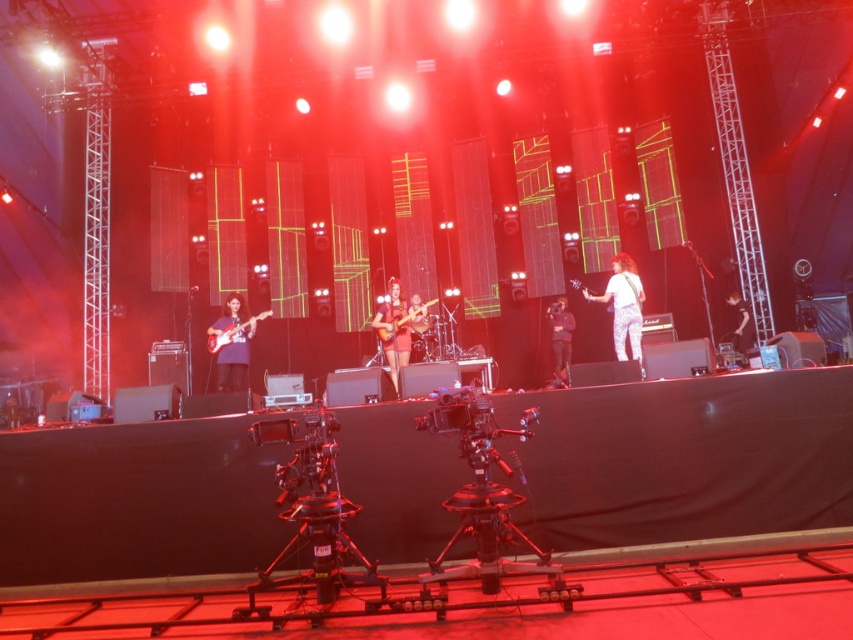
You are a photographer in the front row of the concert. You want to take a photo of both the matte purple guitar at left and the matte pink guitar at center. Which guitar will appear larger in your photo?

The matte purple guitar at left will appear larger in the photo because it is closer to the viewer than the matte pink guitar at center.

You are a photographer standing at the back of the venue, and you want to capture a closeup shot of both the matte purple guitar at left and the matte black electric guitar at left. Given that your camera has a maximum focus range of 10 centimeters, will you be able to capture both guitars in the same frame?

The matte purple guitar at left is 11.16 centimeters away from the matte black electric guitar at left. Since the distance between them exceeds the camera maximum focus range of 10 centimeters, you cannot capture both guitars in the same frame.

You are an audience member sitting in the front row of the live music performance. You notice two points on the stage marked as point 1 at coordinates point (231, 360) and point 2 at coordinates point (210, 342). Which point is closer to you?

Point (231, 360) is closer to the viewer than point (210, 342).